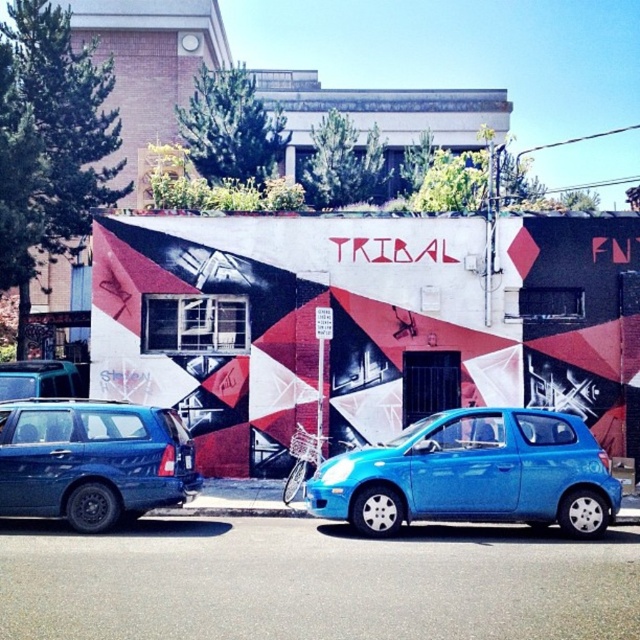
You are a delivery person trying to park your van between the metallic blue hatchback at center and the metallic blue suv at left. Your van is 1.8 meters tall. Can you safely park there without hitting your head?

The metallic blue hatchback at center has a lesser height compared to metallic blue suv at left. Since the hatchback is shorter, the space between them might be lower than the SUV. However, the description only mentions their heights relative to each other, not the actual clearance height. Without knowing the exact height of the hatchback or the suv, it is impossible to determine if the 1.8 meter tall van can safely park there without hitting the head. Please check the actual height of the vehicles before.

You are standing at the curb in front of the building with the mural. You need to park your car in the spot where the metallic blue hatchback at center is currently parked. What is the exact coordinate of the parking spot you should aim for?

The metallic blue hatchback at center is located at point [474,474], so you should aim for that coordinate to park your car there.